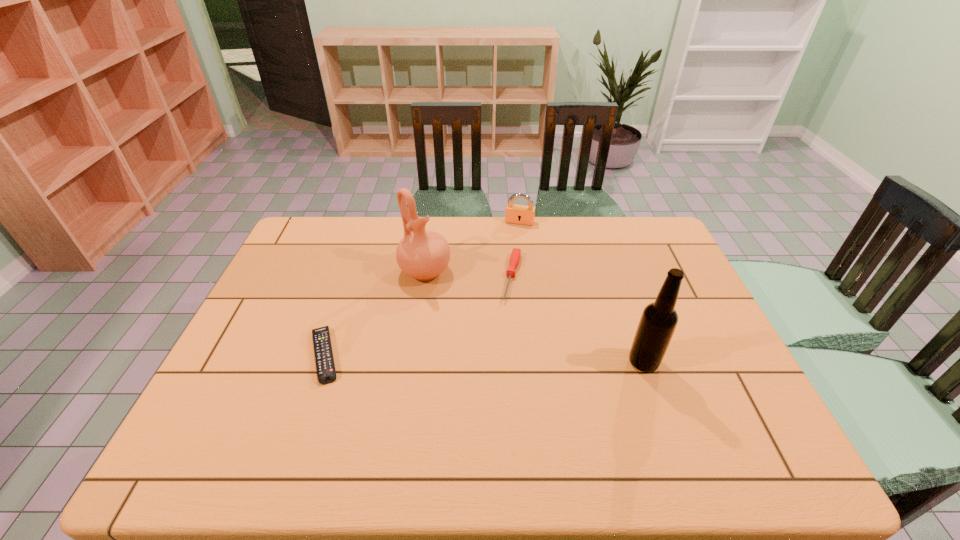
The width and height of the screenshot is (960, 540). What are the coordinates of `remote control` in the screenshot? It's located at (326, 373).

Locate an element on the screen. The width and height of the screenshot is (960, 540). the shortest object is located at coordinates (326, 373).

At what (x,y) coordinates should I click in order to perform the action: click on the rightmost object. Please return your answer as a coordinate pair (x, y). The image size is (960, 540). Looking at the image, I should click on (659, 319).

I want to click on the second object from left to right, so click(x=424, y=255).

This screenshot has height=540, width=960. I want to click on the third shortest object, so click(x=517, y=214).

Identify the location of padlock. (517, 214).

The width and height of the screenshot is (960, 540). Find the location of `screwdriver`. screwdriver is located at coordinates (516, 253).

Locate an element on the screen. vacant space located on the right of the remote control is located at coordinates (471, 355).

Find the location of a particular element. Image resolution: width=960 pixels, height=540 pixels. free space located on the back of the rightmost object is located at coordinates (617, 286).

Locate an element on the screen. vacant position located 0.330m on the spout of the pottery is located at coordinates (513, 350).